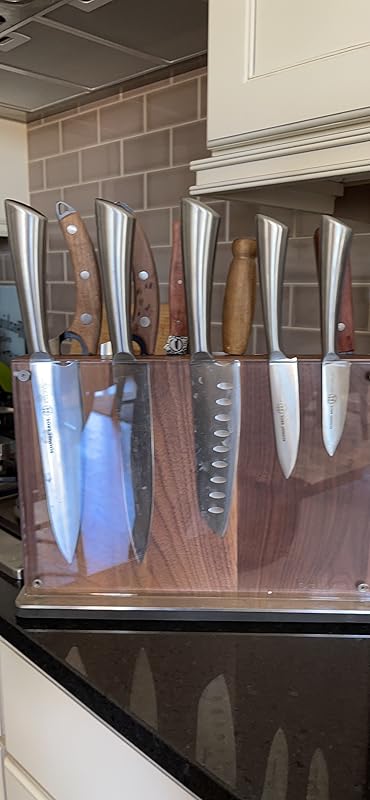
At what (x,y) coordinates should I click in order to perform the action: click on silver vent hood. Please return your answer as a coordinate pair (x, y). The width and height of the screenshot is (370, 800). Looking at the image, I should click on tap(41, 14).